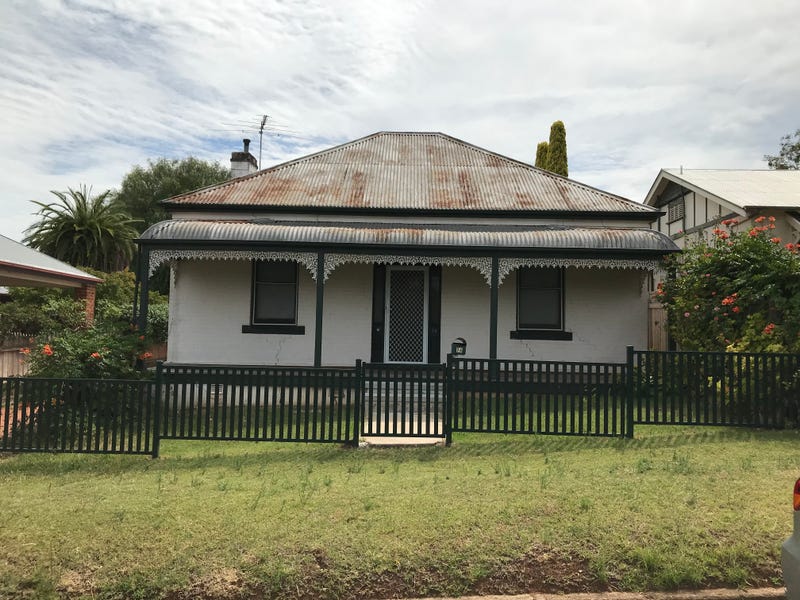
Where is `window frame`? This screenshot has width=800, height=600. window frame is located at coordinates (250, 303).